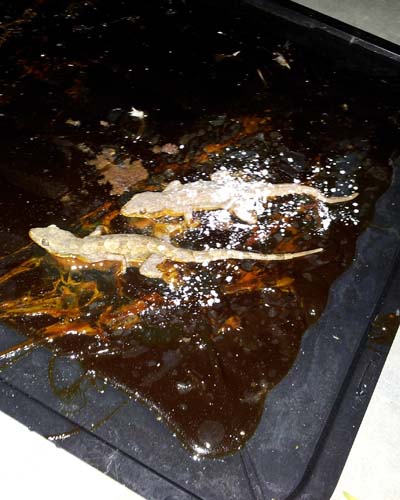
Find the location of a particular element. inner boarder of mat is located at coordinates (323, 429).